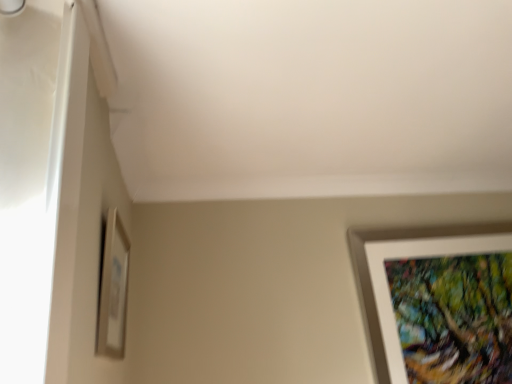
Find the location of a particular element. The width and height of the screenshot is (512, 384). matte white picture frame at lower left, which ranks as the 2th picture frame in back-to-front order is located at coordinates (113, 289).

In order to face matte white picture frame at lower left, the first picture frame positioned from the front, should I rotate leftwards or rightwards?

It's best to rotate left around 17.870 degrees.

The height and width of the screenshot is (384, 512). Describe the element at coordinates (113, 289) in the screenshot. I see `matte white picture frame at lower left, which is the first picture frame in left-to-right order` at that location.

I want to click on white matte picture frame at lower right, which is counted as the second picture frame, starting from the left, so click(x=371, y=279).

What do you see at coordinates (371, 279) in the screenshot? I see `white matte picture frame at lower right, the 1th picture frame when ordered from right to left` at bounding box center [371, 279].

This screenshot has width=512, height=384. Identify the location of matte white picture frame at lower left, which is the first picture frame in left-to-right order. (113, 289).

Can you confirm if white matte picture frame at lower right, which is counted as the second picture frame, starting from the left, is positioned to the right of matte white picture frame at lower left, the first picture frame positioned from the front?

Indeed, white matte picture frame at lower right, which is counted as the second picture frame, starting from the left, is positioned on the right side of matte white picture frame at lower left, the first picture frame positioned from the front.

Which is behind, white matte picture frame at lower right, acting as the 2th picture frame starting from the front, or matte white picture frame at lower left, which is the first picture frame in left-to-right order?

white matte picture frame at lower right, acting as the 2th picture frame starting from the front, is more distant.

Does point (373, 309) come behind point (99, 350)?

Yes.

From the image's perspective, is white matte picture frame at lower right, which ranks as the 1th picture frame in back-to-front order, located above or below matte white picture frame at lower left, which is the first picture frame in left-to-right order?

white matte picture frame at lower right, which ranks as the 1th picture frame in back-to-front order, is situated lower than matte white picture frame at lower left, which is the first picture frame in left-to-right order, in the image.

In the scene shown: From a real-world perspective, which object stands above the other?

matte white picture frame at lower left, the first picture frame positioned from the front, is physically above.

Does white matte picture frame at lower right, acting as the 2th picture frame starting from the front, have a greater width compared to matte white picture frame at lower left, which appears as the second picture frame when viewed from the right?

Yes, white matte picture frame at lower right, acting as the 2th picture frame starting from the front, is wider than matte white picture frame at lower left, which appears as the second picture frame when viewed from the right.

Considering the sizes of white matte picture frame at lower right, acting as the 2th picture frame starting from the front, and matte white picture frame at lower left, which ranks as the 2th picture frame in back-to-front order, in the image, is white matte picture frame at lower right, acting as the 2th picture frame starting from the front, taller or shorter than matte white picture frame at lower left, which ranks as the 2th picture frame in back-to-front order,?

Clearly, white matte picture frame at lower right, acting as the 2th picture frame starting from the front, is taller compared to matte white picture frame at lower left, which ranks as the 2th picture frame in back-to-front order.

Who is smaller, white matte picture frame at lower right, the 1th picture frame when ordered from right to left, or matte white picture frame at lower left, which is the first picture frame in left-to-right order?

With smaller size is matte white picture frame at lower left, which is the first picture frame in left-to-right order.

Is matte white picture frame at lower left, which is the first picture frame in left-to-right order, a part of white matte picture frame at lower right, which is counted as the second picture frame, starting from the left?

No, white matte picture frame at lower right, which is counted as the second picture frame, starting from the left, does not contain matte white picture frame at lower left, which is the first picture frame in left-to-right order.

Is white matte picture frame at lower right, which ranks as the 1th picture frame in back-to-front order, with matte white picture frame at lower left, the first picture frame positioned from the front?

There is a gap between white matte picture frame at lower right, which ranks as the 1th picture frame in back-to-front order, and matte white picture frame at lower left, the first picture frame positioned from the front.

Is matte white picture frame at lower left, which is the first picture frame in left-to-right order, at the back of white matte picture frame at lower right, the 1th picture frame when ordered from right to left?

That's not correct — white matte picture frame at lower right, the 1th picture frame when ordered from right to left, is not looking away from matte white picture frame at lower left, which is the first picture frame in left-to-right order.

Based on the photo, what's the angular difference between white matte picture frame at lower right, which ranks as the 1th picture frame in back-to-front order, and matte white picture frame at lower left, the first picture frame positioned from the front,'s facing directions?

The angular difference between white matte picture frame at lower right, which ranks as the 1th picture frame in back-to-front order, and matte white picture frame at lower left, the first picture frame positioned from the front, is 89.8 degrees.

How much distance is there between white matte picture frame at lower right, which ranks as the 1th picture frame in back-to-front order, and matte white picture frame at lower left, the first picture frame positioned from the front?

white matte picture frame at lower right, which ranks as the 1th picture frame in back-to-front order, and matte white picture frame at lower left, the first picture frame positioned from the front, are 3.36 feet apart.

Find the location of a particular element. The height and width of the screenshot is (384, 512). picture frame located behind the matte white picture frame at lower left, which appears as the second picture frame when viewed from the right is located at coordinates (371, 279).

Considering the positions of objects matte white picture frame at lower left, the first picture frame positioned from the front, and white matte picture frame at lower right, which is counted as the second picture frame, starting from the left, in the image provided, who is more to the right, matte white picture frame at lower left, the first picture frame positioned from the front, or white matte picture frame at lower right, which is counted as the second picture frame, starting from the left,?

From the viewer's perspective, white matte picture frame at lower right, which is counted as the second picture frame, starting from the left, appears more on the right side.

Which object is closer to the camera, matte white picture frame at lower left, which ranks as the 2th picture frame in back-to-front order, or white matte picture frame at lower right, which ranks as the 1th picture frame in back-to-front order?

matte white picture frame at lower left, which ranks as the 2th picture frame in back-to-front order, is in front.

Which is farther from the camera, (x=118, y=263) or (x=447, y=226)?

The point (x=447, y=226) is farther from the camera.

From the image's perspective, which is below, matte white picture frame at lower left, which appears as the second picture frame when viewed from the right, or white matte picture frame at lower right, which ranks as the 1th picture frame in back-to-front order?

white matte picture frame at lower right, which ranks as the 1th picture frame in back-to-front order, is shown below in the image.

From a real-world perspective, who is located higher, matte white picture frame at lower left, the first picture frame positioned from the front, or white matte picture frame at lower right, which is counted as the second picture frame, starting from the left?

matte white picture frame at lower left, the first picture frame positioned from the front, from a real-world perspective.

Can you confirm if matte white picture frame at lower left, the first picture frame positioned from the front, is wider than white matte picture frame at lower right, the 1th picture frame when ordered from right to left?

No.

In terms of height, does matte white picture frame at lower left, which ranks as the 2th picture frame in back-to-front order, look taller or shorter compared to white matte picture frame at lower right, the 1th picture frame when ordered from right to left?

matte white picture frame at lower left, which ranks as the 2th picture frame in back-to-front order, is shorter than white matte picture frame at lower right, the 1th picture frame when ordered from right to left.

Looking at this image, is matte white picture frame at lower left, which appears as the second picture frame when viewed from the right, bigger than white matte picture frame at lower right, which is counted as the second picture frame, starting from the left?

No, matte white picture frame at lower left, which appears as the second picture frame when viewed from the right, is not bigger than white matte picture frame at lower right, which is counted as the second picture frame, starting from the left.

Would you say matte white picture frame at lower left, which is the first picture frame in left-to-right order, contains white matte picture frame at lower right, which ranks as the 1th picture frame in back-to-front order?

No, white matte picture frame at lower right, which ranks as the 1th picture frame in back-to-front order, is not a part of matte white picture frame at lower left, which is the first picture frame in left-to-right order.

Is matte white picture frame at lower left, which appears as the second picture frame when viewed from the right, with white matte picture frame at lower right, the 1th picture frame when ordered from right to left?

No, matte white picture frame at lower left, which appears as the second picture frame when viewed from the right, is not making contact with white matte picture frame at lower right, the 1th picture frame when ordered from right to left.

Based on the photo, is matte white picture frame at lower left, which ranks as the 2th picture frame in back-to-front order, oriented away from white matte picture frame at lower right, the 1th picture frame when ordered from right to left?

No.

What's the angular difference between matte white picture frame at lower left, the first picture frame positioned from the front, and white matte picture frame at lower right, which is counted as the second picture frame, starting from the left,'s facing directions?

There is a 89.8-degree angle between the facing directions of matte white picture frame at lower left, the first picture frame positioned from the front, and white matte picture frame at lower right, which is counted as the second picture frame, starting from the left.

Looking at this image, how far apart are matte white picture frame at lower left, which appears as the second picture frame when viewed from the right, and white matte picture frame at lower right, which ranks as the 1th picture frame in back-to-front order?

matte white picture frame at lower left, which appears as the second picture frame when viewed from the right, is 1.02 meters away from white matte picture frame at lower right, which ranks as the 1th picture frame in back-to-front order.

This screenshot has height=384, width=512. In order to click on picture frame that is on the left side of white matte picture frame at lower right, which ranks as the 1th picture frame in back-to-front order in this screenshot , I will do coord(113,289).

Locate an element on the screen. picture frame located above the white matte picture frame at lower right, which ranks as the 1th picture frame in back-to-front order (from the image's perspective) is located at coordinates tap(113, 289).

This screenshot has width=512, height=384. I want to click on picture frame below the matte white picture frame at lower left, which is the first picture frame in left-to-right order (from the image's perspective), so click(x=371, y=279).